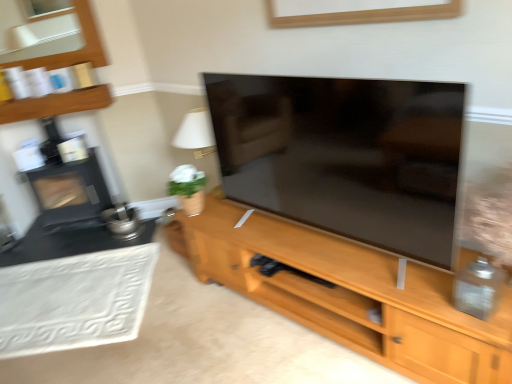
Image resolution: width=512 pixels, height=384 pixels. Find the location of `vacant space situated above white textured rug at lower left (from a real-world perspective)`. vacant space situated above white textured rug at lower left (from a real-world perspective) is located at coordinates (67, 291).